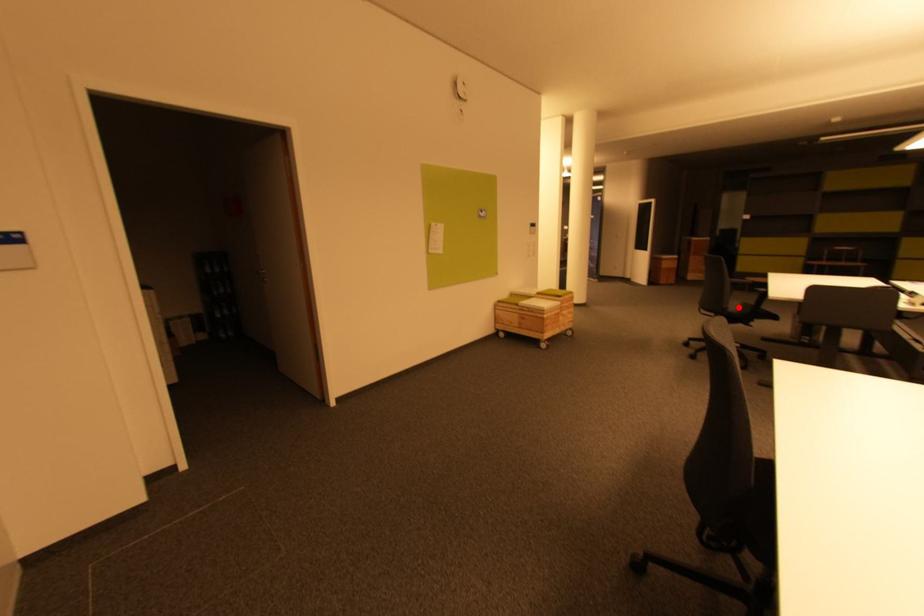
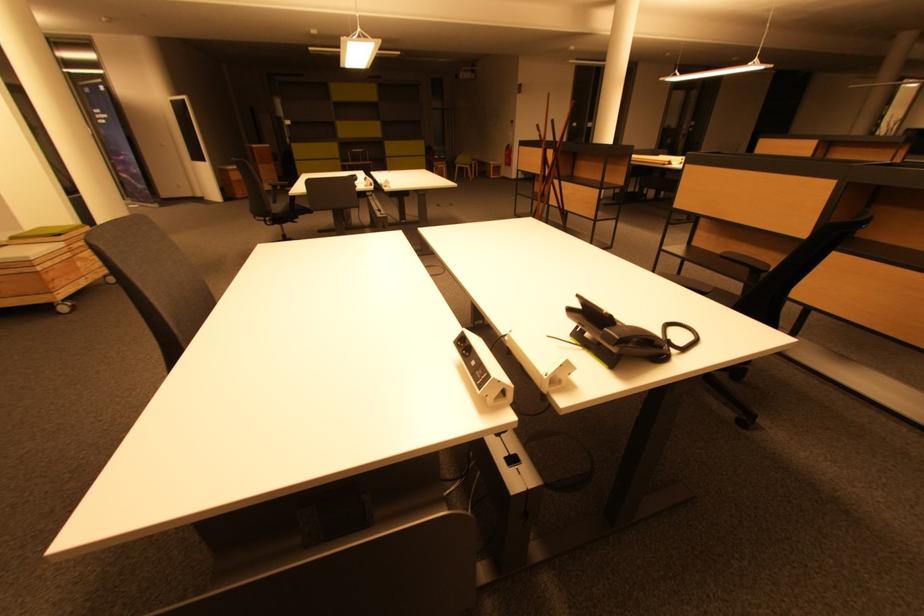
The point at the highlighted location is marked in the first image. Where is the corresponding point in the second image?

(281, 209)